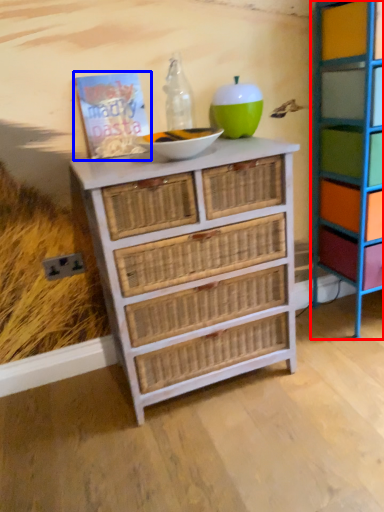
Question: Which object appears closest to the camera in this image, shelf (highlighted by a red box) or book (highlighted by a blue box)?

Choices:
 (A) shelf
 (B) book

Answer: (A)